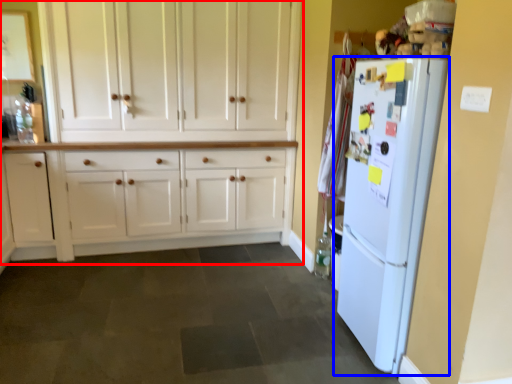
Question: Which object appears farthest to the camera in this image, cabinetry (highlighted by a red box) or refrigerator (highlighted by a blue box)?

Choices:
 (A) cabinetry
 (B) refrigerator

Answer: (A)